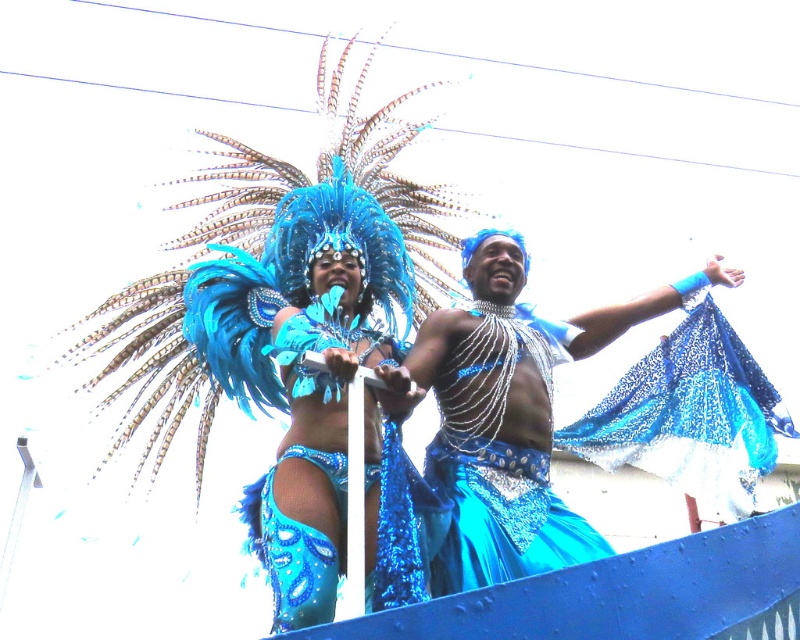
Question: Does shiny blue costume at center have a smaller size compared to shiny blue fabric at center?

Choices:
 (A) no
 (B) yes

Answer: (A)

Question: Which point is farther from the camera taking this photo?

Choices:
 (A) (740, 467)
 (B) (332, 465)
 (C) (496, 429)
 (D) (500, 508)

Answer: (A)

Question: Can you confirm if shiny blue costume at center is positioned below sparkly blue costume at center?

Choices:
 (A) no
 (B) yes

Answer: (A)

Question: Which of the following is the farthest from the observer?

Choices:
 (A) (658, 360)
 (B) (376, 349)
 (C) (538, 545)

Answer: (A)

Question: Which object is closer to the camera taking this photo?

Choices:
 (A) shiny blue costume at center
 (B) shiny blue fabric at center
 (C) glittery blue fabric at center
 (D) sparkly blue costume at center

Answer: (A)

Question: Does shiny blue costume at center appear on the left side of shiny blue fabric at center?

Choices:
 (A) no
 (B) yes

Answer: (B)